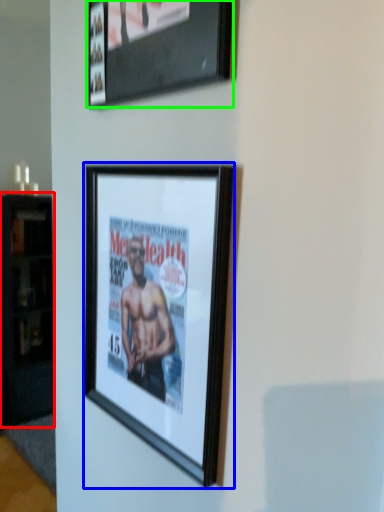
Question: Based on their relative distances, which object is nearer to cabinetry (highlighted by a red box)? Choose from picture frame (highlighted by a blue box) and picture frame (highlighted by a green box).

Choices:
 (A) picture frame
 (B) picture frame

Answer: (A)